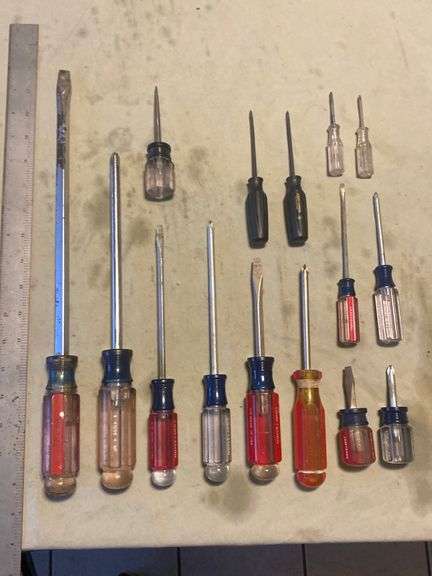
Where is `table full of screwdrivers`? Image resolution: width=432 pixels, height=576 pixels. table full of screwdrivers is located at coordinates (193, 507).